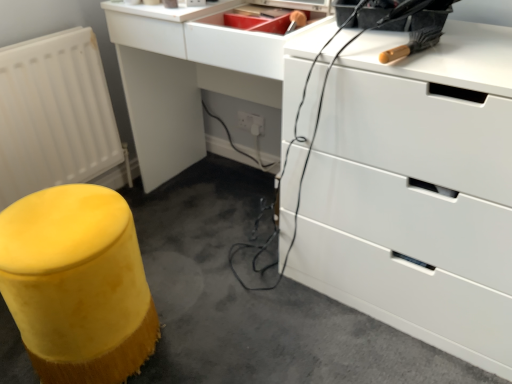
Where is `white matte radiator at lower left`? This screenshot has height=384, width=512. white matte radiator at lower left is located at coordinates (54, 114).

Locate an element on the screen. yellow fabric stool at lower left is located at coordinates (255, 300).

I want to click on concrete that appears in front of the yellow fuzzy stool at lower left, so click(255, 300).

Can you confirm if yellow fabric stool at lower left is positioned to the left of yellow fuzzy stool at lower left?

No.

Looking at this image, which object is closer to the camera, yellow fabric stool at lower left or yellow fuzzy stool at lower left?

yellow fabric stool at lower left is in front.

Is yellow fabric stool at lower left wider or thinner than yellow fuzzy stool at lower left?

In the image, yellow fabric stool at lower left appears to be wider than yellow fuzzy stool at lower left.

Between yellow fuzzy stool at lower left and white glossy chest of drawers at upper right, which one has smaller width?

yellow fuzzy stool at lower left is thinner.

From the image's perspective, which one is positioned higher, yellow fuzzy stool at lower left or white glossy chest of drawers at upper right?

white glossy chest of drawers at upper right appears higher in the image.

Is yellow fuzzy stool at lower left spatially inside white glossy chest of drawers at upper right, or outside of it?

yellow fuzzy stool at lower left is not inside white glossy chest of drawers at upper right, it's outside.

Is yellow fuzzy stool at lower left oriented towards white glossy chest of drawers at upper right?

No, yellow fuzzy stool at lower left is not aimed at white glossy chest of drawers at upper right.

From the picture: Is white glossy chest of drawers at upper right oriented away from white matte radiator at lower left?

white glossy chest of drawers at upper right is not turned away from white matte radiator at lower left.

In the scene shown: Is white matte radiator at lower left completely or partially inside white glossy chest of drawers at upper right?

No, white glossy chest of drawers at upper right does not contain white matte radiator at lower left.

Based on the photo, which of these two, white glossy chest of drawers at upper right or white matte radiator at lower left, is wider?

With larger width is white glossy chest of drawers at upper right.

Is white glossy chest of drawers at upper right positioned behind white matte radiator at lower left?

No.

From the picture: From a real-world perspective, who is located higher, white matte radiator at lower left or yellow fuzzy stool at lower left?

From a 3D spatial view, white matte radiator at lower left is above.

Considering the positions of objects white matte radiator at lower left and yellow fuzzy stool at lower left in the image provided, who is in front, white matte radiator at lower left or yellow fuzzy stool at lower left?

yellow fuzzy stool at lower left is in front.

Can you confirm if white matte radiator at lower left is positioned to the left of yellow fuzzy stool at lower left?

Yes.

From the image's perspective, which object appears higher, white matte radiator at lower left or yellow fuzzy stool at lower left?

white matte radiator at lower left appears higher in the image.

Looking at this image, are yellow fabric stool at lower left and white matte radiator at lower left located far from each other?

No.

Which of these two, yellow fabric stool at lower left or white matte radiator at lower left, is wider?

Wider between the two is yellow fabric stool at lower left.

Is yellow fabric stool at lower left aimed at white matte radiator at lower left?

No, yellow fabric stool at lower left is not turned towards white matte radiator at lower left.

Is white matte radiator at lower left oriented towards white glossy chest of drawers at upper right?

Yes, white matte radiator at lower left faces towards white glossy chest of drawers at upper right.

Between point (10, 45) and point (339, 158), which one is positioned behind?

Positioned behind is point (10, 45).

From the image's perspective, relative to white glossy chest of drawers at upper right, is white matte radiator at lower left above or below?

white matte radiator at lower left is situated higher than white glossy chest of drawers at upper right in the image.

Is yellow fuzzy stool at lower left aimed at white matte radiator at lower left?

No, yellow fuzzy stool at lower left is not aimed at white matte radiator at lower left.

You are a GUI agent. You are given a task and a screenshot of the screen. Output one action in this format:
    pyautogui.click(x=<x>, y=<y>)
    Task: Click on the furniture below the white matte radiator at lower left (from the image's perspective)
    Image resolution: width=512 pixels, height=384 pixels.
    Given the screenshot: What is the action you would take?
    pyautogui.click(x=77, y=284)

From a real-world perspective, is yellow fuzzy stool at lower left positioned above or below white matte radiator at lower left?

yellow fuzzy stool at lower left is below white matte radiator at lower left.

Image resolution: width=512 pixels, height=384 pixels. In the image, there is a yellow fuzzy stool at lower left. What are the coordinates of `concrete below it (from a real-world perspective)` in the screenshot? It's located at (255, 300).

This screenshot has width=512, height=384. In order to click on furniture to the left of white glossy chest of drawers at upper right in this screenshot , I will do `click(77, 284)`.

Considering their positions, is yellow fuzzy stool at lower left positioned closer to yellow fabric stool at lower left than white glossy chest of drawers at upper right?

yellow fuzzy stool at lower left is positioned closer to the anchor yellow fabric stool at lower left.

From the image, which object appears to be farther from yellow fuzzy stool at lower left, yellow fabric stool at lower left or white glossy chest of drawers at upper right?

The object further to yellow fuzzy stool at lower left is white glossy chest of drawers at upper right.

Consider the image. From the image, which object appears to be nearer to white glossy chest of drawers at upper right, white matte radiator at lower left or yellow fabric stool at lower left?

yellow fabric stool at lower left is closer to white glossy chest of drawers at upper right.

Looking at the image, which one is located closer to yellow fuzzy stool at lower left, white matte radiator at lower left or yellow fabric stool at lower left?

yellow fabric stool at lower left is closer to yellow fuzzy stool at lower left.

Estimate the real-world distances between objects in this image. Which object is closer to yellow fabric stool at lower left, white glossy chest of drawers at upper right or white matte radiator at lower left?

Based on the image, white glossy chest of drawers at upper right appears to be nearer to yellow fabric stool at lower left.

From the image, which object appears to be farther from white glossy chest of drawers at upper right, yellow fuzzy stool at lower left or white matte radiator at lower left?

white matte radiator at lower left is positioned further to the anchor white glossy chest of drawers at upper right.

Looking at the image, which one is located further to yellow fabric stool at lower left, white matte radiator at lower left or yellow fuzzy stool at lower left?

Based on the image, white matte radiator at lower left appears to be further to yellow fabric stool at lower left.

Which object lies nearer to the anchor point white glossy chest of drawers at upper right, yellow fabric stool at lower left or white matte radiator at lower left?

Based on the image, yellow fabric stool at lower left appears to be nearer to white glossy chest of drawers at upper right.

Find the location of a particular element. This screenshot has height=384, width=512. concrete between yellow fuzzy stool at lower left and white glossy chest of drawers at upper right is located at coordinates (255, 300).

Find the location of a particular element. This screenshot has height=384, width=512. furniture located between white matte radiator at lower left and white glossy chest of drawers at upper right in the left-right direction is located at coordinates (77, 284).

Locate an element on the screen. The width and height of the screenshot is (512, 384). furniture between white matte radiator at lower left and yellow fabric stool at lower left in the horizontal direction is located at coordinates (77, 284).

Image resolution: width=512 pixels, height=384 pixels. Find the location of `concrete between white matte radiator at lower left and white glossy chest of drawers at upper right`. concrete between white matte radiator at lower left and white glossy chest of drawers at upper right is located at coordinates (255, 300).